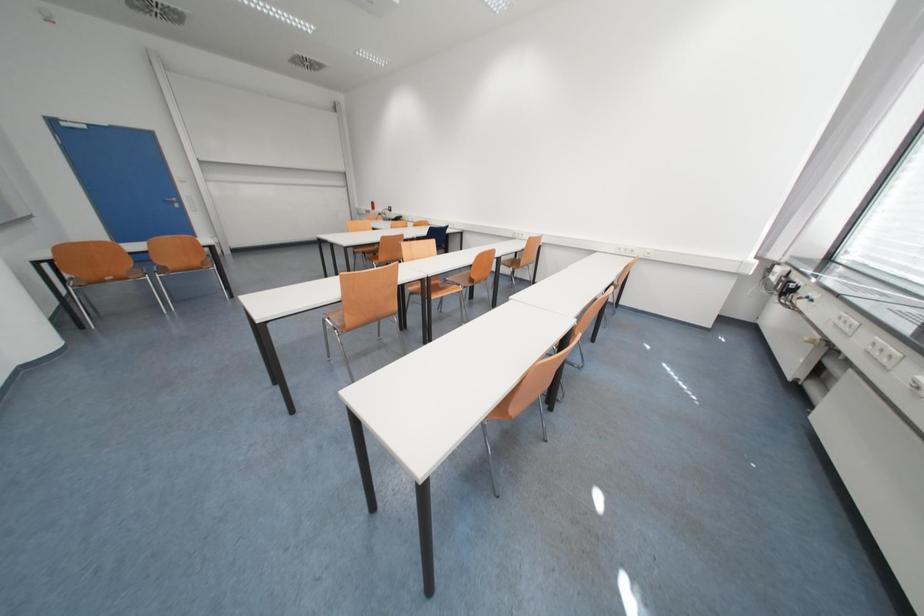
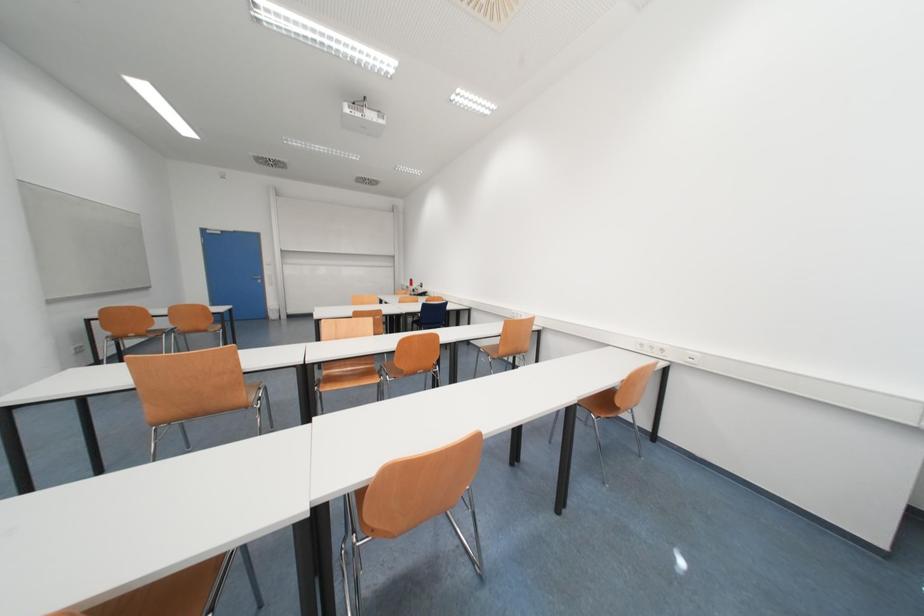
In a continuous first-person perspective shot, in which direction is the camera moving?

The movement direction of the cameraman is right, forward.